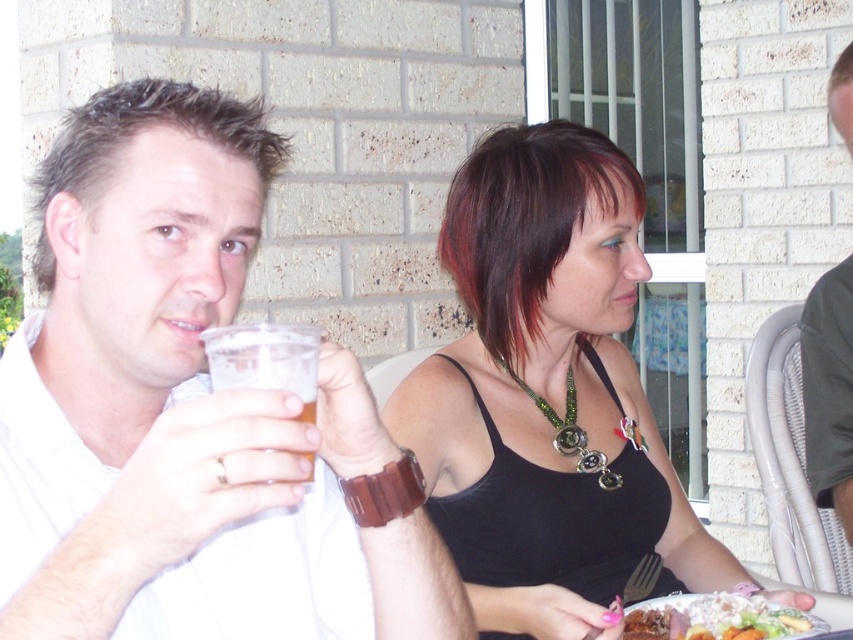
Which of these two, black fabric tank top at center or dark gray fabric shirt at upper right, stands shorter?

With less height is dark gray fabric shirt at upper right.

Is black fabric tank top at center in front of dark gray fabric shirt at upper right?

Yes, black fabric tank top at center is in front of dark gray fabric shirt at upper right.

You are a GUI agent. You are given a task and a screenshot of the screen. Output one action in this format:
    pyautogui.click(x=<x>, y=<y>)
    Task: Click on the black fabric tank top at center
    The image size is (853, 640).
    Given the screenshot: What is the action you would take?
    pyautogui.click(x=548, y=396)

Can you confirm if dark gray fabric shirt at upper right is wider than white creamy mashed potatoes at lower right?

No, dark gray fabric shirt at upper right is not wider than white creamy mashed potatoes at lower right.

Is point (844, 60) less distant than point (782, 609)?

No.

The height and width of the screenshot is (640, 853). What do you see at coordinates (828, 390) in the screenshot?
I see `dark gray fabric shirt at upper right` at bounding box center [828, 390].

This screenshot has height=640, width=853. I want to click on dark gray fabric shirt at upper right, so click(x=828, y=390).

Which is below, clear plastic cup at upper center or white creamy mashed potatoes at lower right?

white creamy mashed potatoes at lower right is below.

Is clear plastic cup at upper center further to camera compared to white creamy mashed potatoes at lower right?

No, it is in front of white creamy mashed potatoes at lower right.

Is point (218, 348) closer to viewer compared to point (724, 596)?

Yes, point (218, 348) is closer to viewer.

At what (x,y) coordinates should I click in order to perform the action: click on clear plastic cup at upper center. Please return your answer as a coordinate pair (x, y). Looking at the image, I should click on click(265, 358).